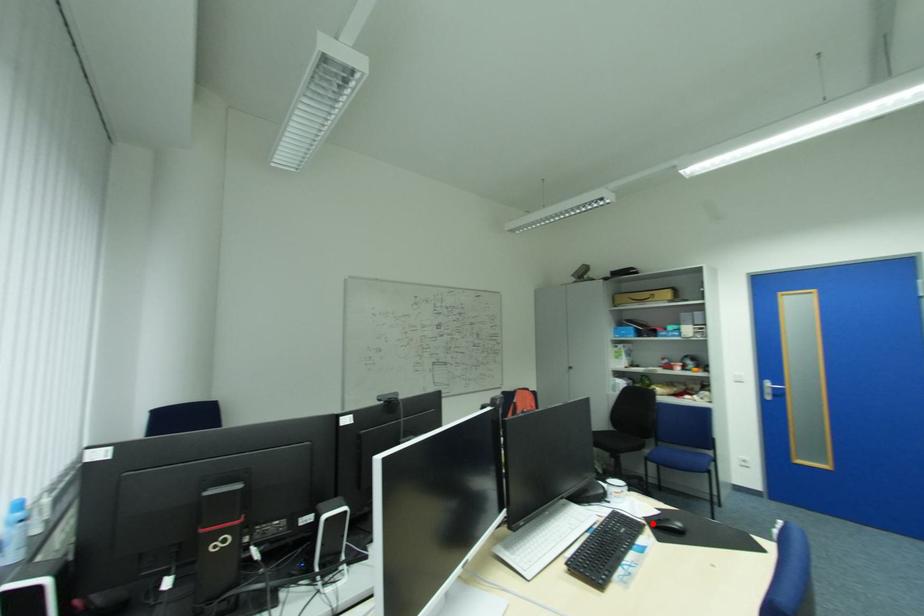
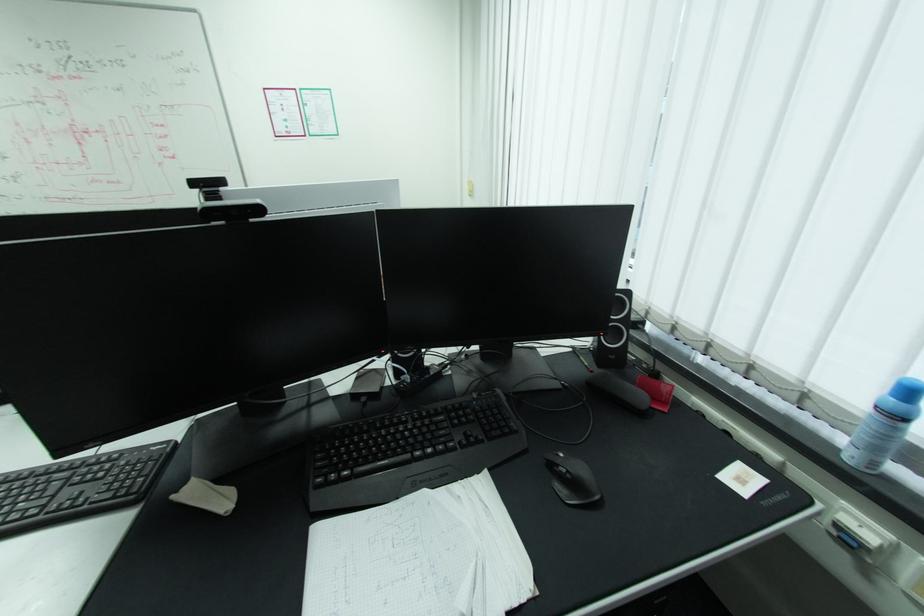
Question: I am providing you with two images of the same scene from different viewpoints. A red point is marked on the first image. Can you still see the location of the red point in image 2?

Choices:
 (A) Yes
 (B) No

Answer: (B)